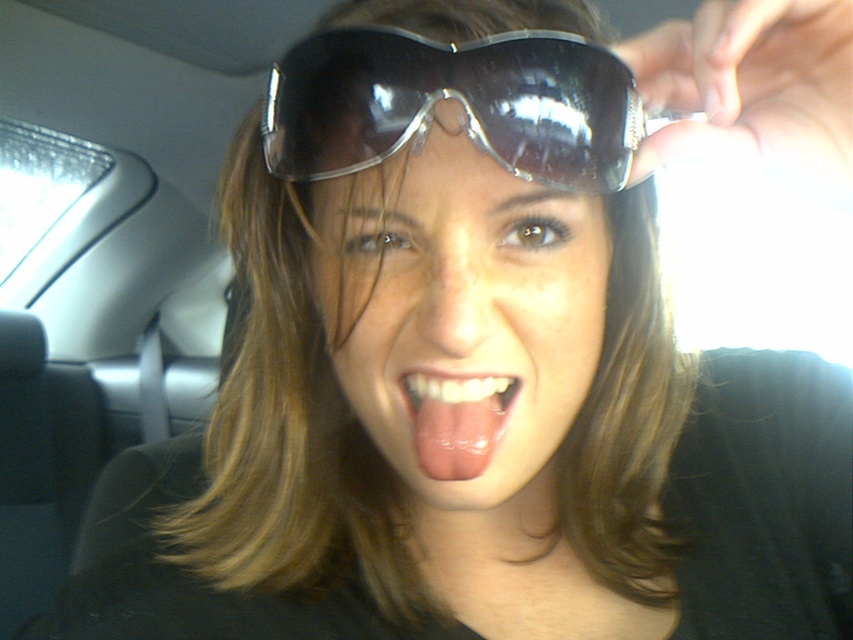
You are designing a new car seat headrest that needs to fit both the shiny black goggles at center and the pink glossy tongue at center without overlapping. Since the headrest has limited space, which object should be placed first to ensure both can fit?

The shiny black goggles at center should be placed first because its width is greater than the pink glossy tongue at center, ensuring there is enough space for both.

You are a photographer trying to capture a clear shot of the pink glossy tongue at center and the glossy plastic sunglasses at center. Since the sunlight is causing glare, which object should you adjust your camera angle to avoid the glare first?

The glossy plastic sunglasses at center is taller than the pink glossy tongue at center, so you should adjust your camera angle to avoid the glare on the glossy plastic sunglasses at center first.

You are a passenger in a car and want to place your glossy plastic sunglasses at center and shiny black goggles at center on the dashboard without them overlapping. Given that the dashboard has a width of 10 inches, can both items fit side by side?

The glossy plastic sunglasses at center is 2.11 inches away from shiny black goggles at center. Since the dashboard is 10 inches wide, and the distance between the two items is only 2.11 inches, there is sufficient space to place both items side by side without overlapping.